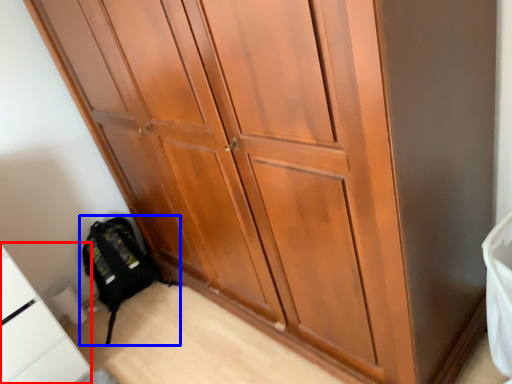
Question: Among these objects, which one is farthest to the camera, cabinetry (highlighted by a red box) or backpack (highlighted by a blue box)?

Choices:
 (A) cabinetry
 (B) backpack

Answer: (B)